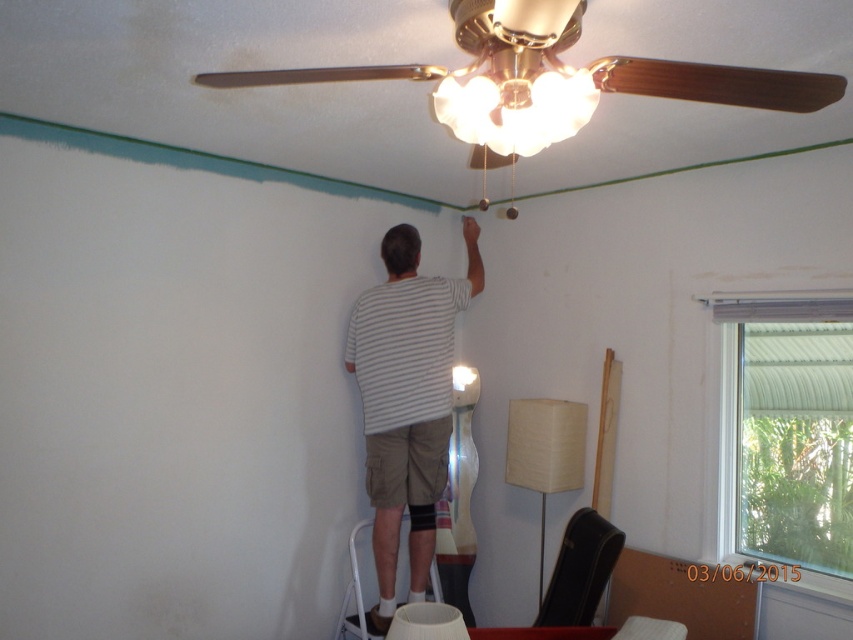
Question: Which object is positioned farthest from the striped cotton shirt at upper center?

Choices:
 (A) white fabric lampshade at upper center
 (B) white metal ladder at lower center

Answer: (A)

Question: Is matte glass lampshade at center to the left of white metal ladder at lower center from the viewer's perspective?

Choices:
 (A) no
 (B) yes

Answer: (A)

Question: Is wooden ceiling fan at upper center above striped cotton shirt at upper center?

Choices:
 (A) yes
 (B) no

Answer: (A)

Question: Can you confirm if striped cotton shirt at upper center is positioned above matte glass lampshade at center?

Choices:
 (A) yes
 (B) no

Answer: (B)

Question: Estimate the real-world distances between objects in this image. Which object is farther from the white fabric lampshade at upper center?

Choices:
 (A) matte glass lampshade at center
 (B) striped cotton shirt at upper center
 (C) white metal ladder at lower center

Answer: (A)

Question: Which of the following is the farthest from the observer?

Choices:
 (A) (364, 522)
 (B) (410, 435)

Answer: (A)